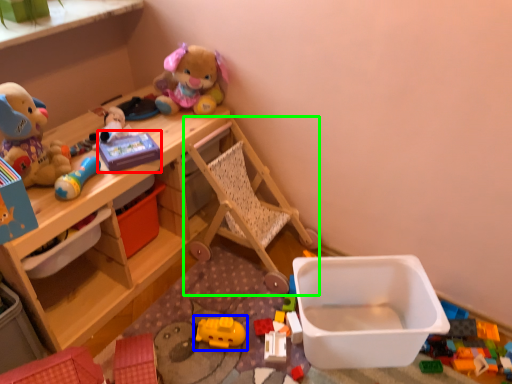
Question: Which object is the closest to the toy (highlighted by a red box)? Choose among these: toy (highlighted by a blue box) or baby carriage (highlighted by a green box).

Choices:
 (A) toy
 (B) baby carriage

Answer: (B)